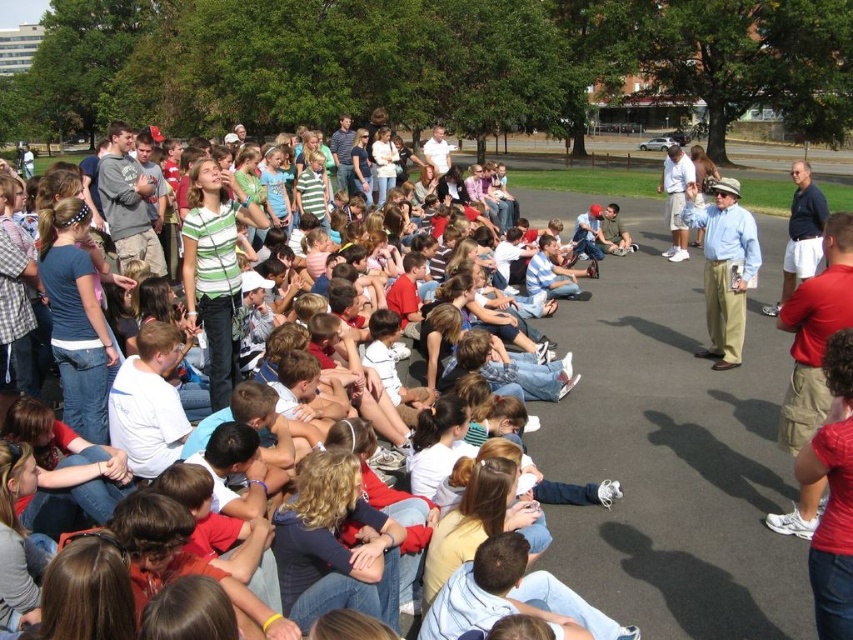
Question: Which point is farther to the camera?

Choices:
 (A) (285, 440)
 (B) (735, 288)

Answer: (B)

Question: Is striped shirt at center in front of light blue shirt at center?

Choices:
 (A) no
 (B) yes

Answer: (B)

Question: Is striped shirt at center in front of light blue shirt at center?

Choices:
 (A) no
 (B) yes

Answer: (B)

Question: Can you confirm if striped shirt at center is thinner than light blue shirt at center?

Choices:
 (A) yes
 (B) no

Answer: (B)